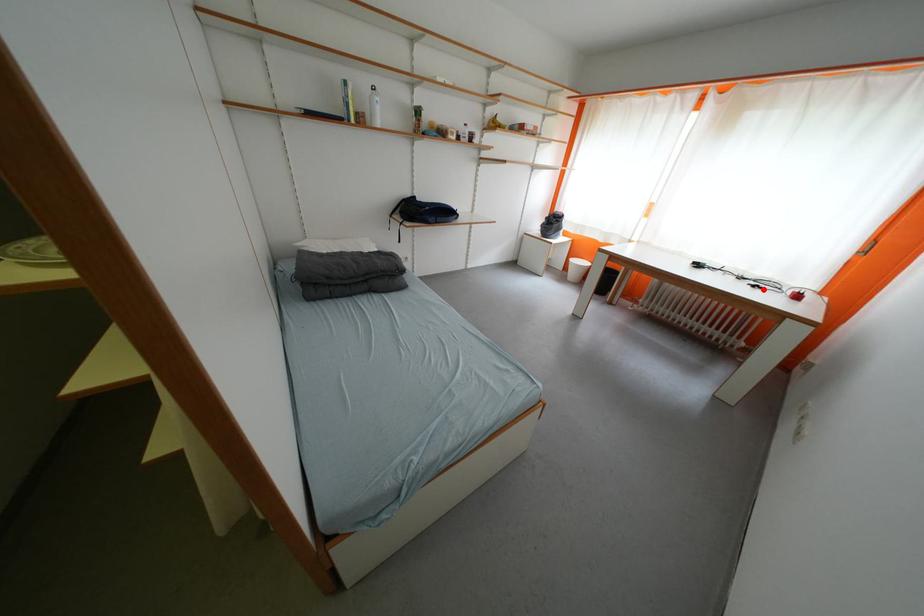
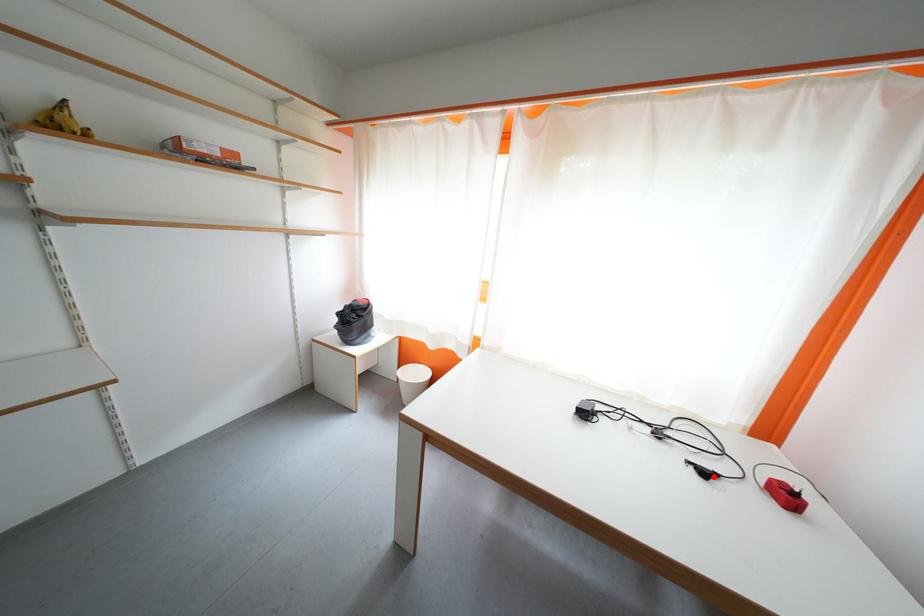
I am providing you with two images of the same scene from different viewpoints. A red point is marked on the first image and another point is marked on the second image. Is the marked point in image1 the same physical position as the marked point in image2?

Yes